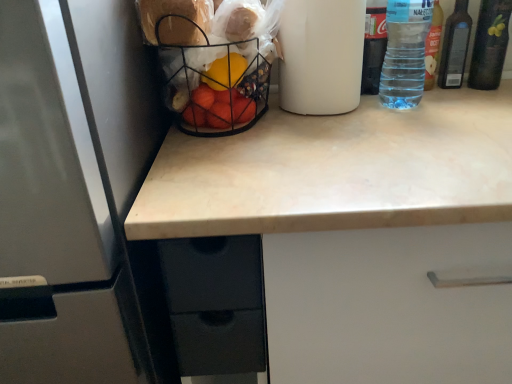
Question: From a real-world perspective, is transparent plastic bottle at upper right, arranged as the 3th bottle when viewed from the right, positioned above or below transparent plastic bottle at upper right, the fourth bottle when ordered from right to left?

Choices:
 (A) above
 (B) below

Answer: (A)

Question: From the image's perspective, is transparent plastic bottle at upper right, arranged as the 3th bottle when viewed from the right, above or below transparent plastic bottle at upper right, which ranks as the 1th bottle in left-to-right order?

Choices:
 (A) above
 (B) below

Answer: (B)

Question: Which object is the closest to the clear plastic bottle at upper right, positioned as the third bottle in left-to-right order?

Choices:
 (A) wire mesh basket at center
 (B) dark green glass bottle at upper right, which is the 4th bottle in left-to-right order
 (C) transparent plastic bottle at upper right, the fourth bottle when ordered from right to left
 (D) satin white refrigerator at left
 (E) beige marble countertop at center

Answer: (B)

Question: Estimate the real-world distances between objects in this image. Which object is closer to the transparent plastic bottle at upper right, the fourth bottle when ordered from right to left?

Choices:
 (A) dark green glass bottle at upper right, which is the 4th bottle in left-to-right order
 (B) clear plastic bottle at upper right, positioned as the third bottle in left-to-right order
 (C) beige marble countertop at center
 (D) transparent plastic bottle at upper right, arranged as the 3th bottle when viewed from the right
 (E) satin white refrigerator at left

Answer: (D)